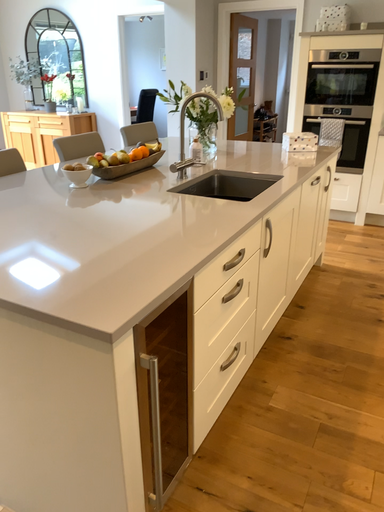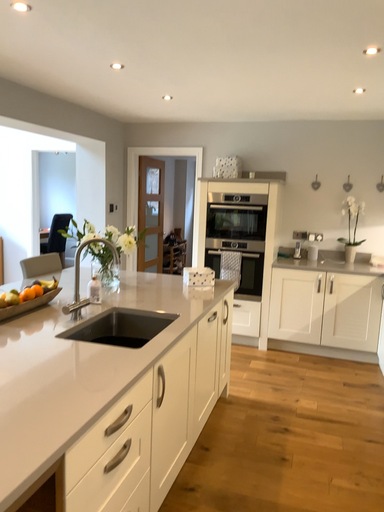
Question: Which way did the camera rotate in the video?

Choices:
 (A) rotated upward
 (B) rotated downward

Answer: (A)